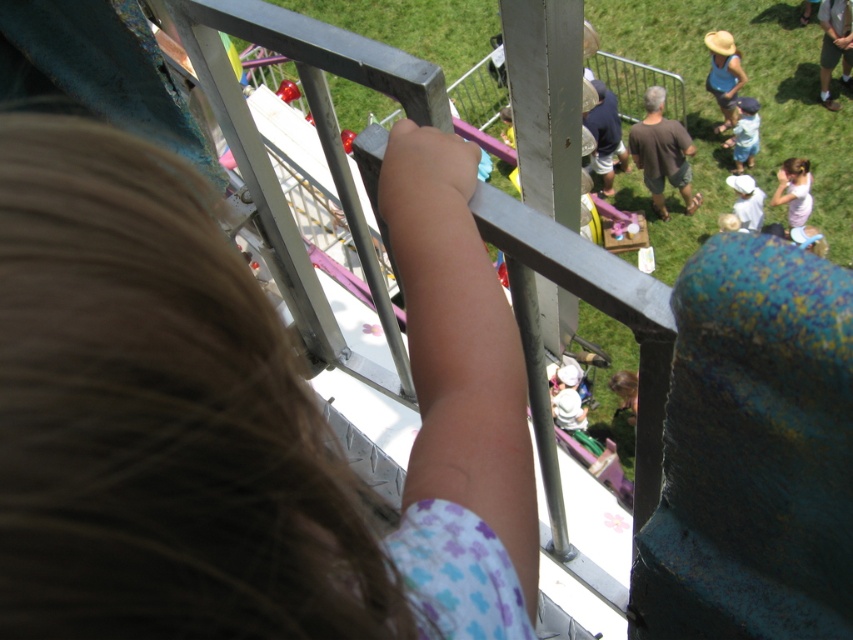
Question: Does blonde hair at upper left lie in front of brown cotton shirt at center?

Choices:
 (A) no
 (B) yes

Answer: (B)

Question: Which of the following is the closest to the observer?

Choices:
 (A) (675, 125)
 (B) (32, 477)

Answer: (B)

Question: Can you confirm if blonde hair at upper left is positioned to the right of brown cotton shirt at center?

Choices:
 (A) yes
 (B) no

Answer: (B)

Question: Among these points, which one is farthest from the camera?

Choices:
 (A) (688, 186)
 (B) (82, 516)

Answer: (A)

Question: Is blonde hair at upper left behind brown cotton shirt at center?

Choices:
 (A) yes
 (B) no

Answer: (B)

Question: Which object is farther from the camera taking this photo?

Choices:
 (A) blonde hair at upper left
 (B) brown cotton shirt at center

Answer: (B)